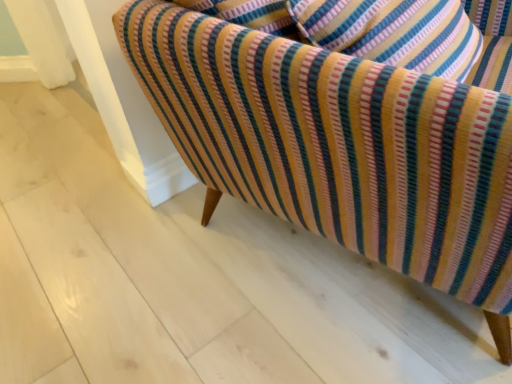
Describe the element at coordinates (338, 146) in the screenshot. This screenshot has width=512, height=384. I see `striped fabric sofa at center` at that location.

What are the coordinates of `striped fabric sofa at center` in the screenshot? It's located at (338, 146).

Where is `striped fabric sofa at center`? The height and width of the screenshot is (384, 512). striped fabric sofa at center is located at coordinates (338, 146).